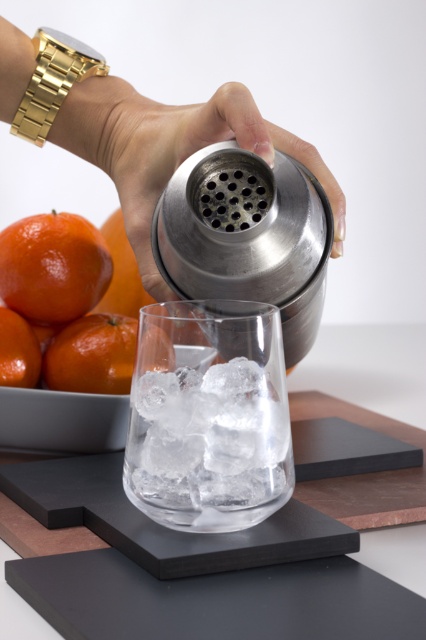
You are a bartender who needs to pour a drink into a glass that is 10 inches away from the polished metallic cocktail shaker at center. Can you pour the drink without moving the shaker?

The polished metallic cocktail shaker at center and camera are 8.75 inches apart from each other. Since the glass is 10 inches away from the shaker, the bartender can pour the drink without moving the shaker as the distance is sufficient.

You are a bartender preparing a cocktail and need to place the orangesmoothfruit at lower left and orangesmoothorange at lower left on a shelf. The shelf has a width of 1 inch. Can both items fit side by side on the shelf without overlapping?

The orangesmoothfruit at lower left is 0.88 inches from orangesmoothorange at lower left, so both items can fit side by side on the 1 inch shelf since their combined width is less than the shelf width.

Based on the photo, you are a bartender trying to place two garnishes on the slate surface. The first garnish must be placed at point A, which is at coordinate point(81, 387), and the second garnish must be placed at point B, which is at coordinate point(9, 360). If you want to place both garnishes so that the first garnish is closer to the cocktail shaker than the second, is this possible?

Point A at point(81, 387) is behind point B at point(9, 360), so placing the first garnish at point A would mean it is farther from the cocktail shaker compared to point B. Therefore, it is not possible to place both garnishes such that the first garnish is closer to the cocktail shaker than the second.